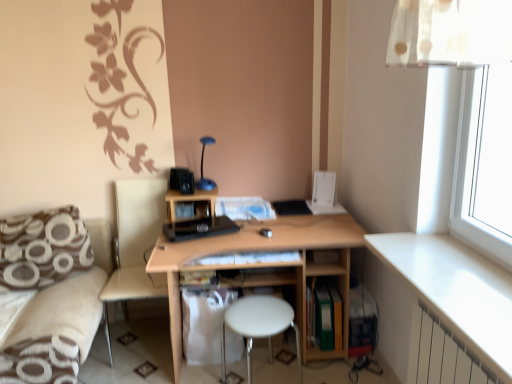
Find the location of a particular element. This screenshot has width=512, height=384. free spot above white plastic stool at center (from a real-world perspective) is located at coordinates (257, 313).